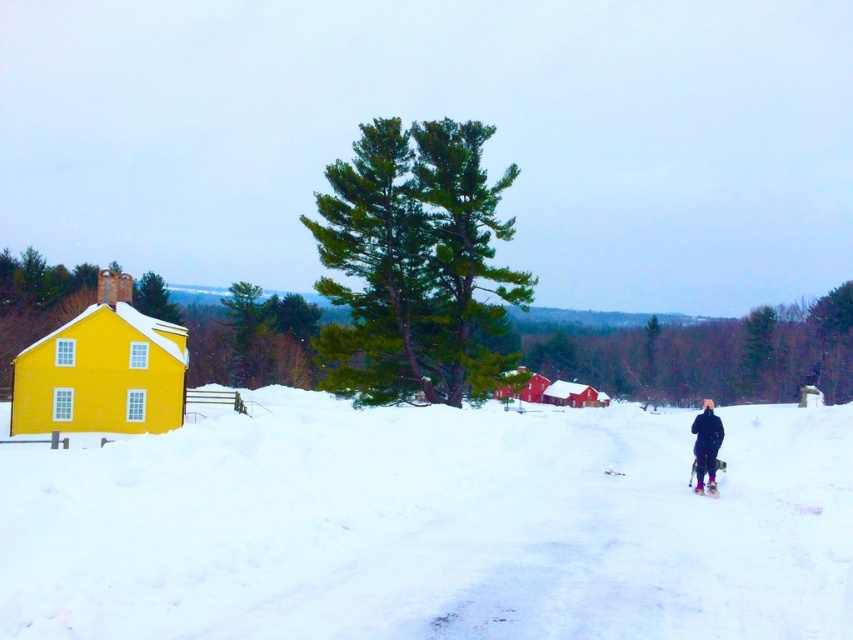
Question: Can you confirm if white fluffy snow at lower center is thinner than matte pink ski at lower right?

Choices:
 (A) no
 (B) yes

Answer: (A)

Question: Which of these objects is positioned farthest from the white fluffy snow at lower center?

Choices:
 (A) matte pink ski at lower right
 (B) dark blue fabric jacket at lower right
 (C) green needle-like at center

Answer: (C)

Question: Does dark blue fabric jacket at lower right appear under matte pink ski at lower right?

Choices:
 (A) no
 (B) yes

Answer: (A)

Question: Is white fluffy snow at lower center to the left of green needle-like at center from the viewer's perspective?

Choices:
 (A) no
 (B) yes

Answer: (A)

Question: Among these points, which one is farthest from the camera?

Choices:
 (A) (550, 516)
 (B) (714, 488)
 (C) (395, 387)
 (D) (711, 483)

Answer: (C)

Question: Which object is positioned farthest from the matte pink ski at lower right?

Choices:
 (A) white fluffy snow at lower center
 (B) green needle-like at center
 (C) dark blue fabric jacket at lower right

Answer: (B)